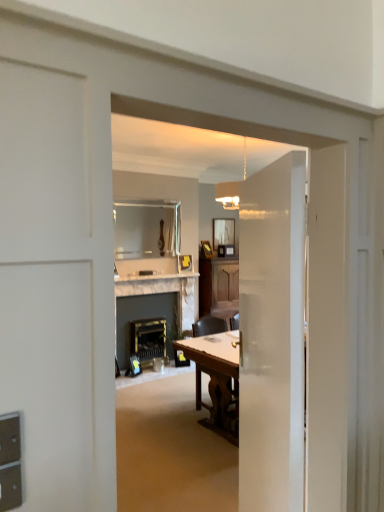
What do you see at coordinates (155, 276) in the screenshot? This screenshot has height=512, width=384. I see `white marble fireplace at center` at bounding box center [155, 276].

Measure the distance between white marble fireplace at center and camera.

5.73 meters.

From the picture: How much space does matte glass mirror at upper center, the 2th mirror when ordered from front to back, occupy vertically?

51.49 centimeters.

What do you see at coordinates (216, 381) in the screenshot? I see `wooden table at center` at bounding box center [216, 381].

Based on the photo, in order to face metallic brass fireplace at center, should I rotate leftwards or rightwards?

Rotate left and turn 5.349 degrees.

The image size is (384, 512). Find the location of `wooden chair at center`. wooden chair at center is located at coordinates (209, 326).

Find the location of a particular element. This screenshot has height=512, width=384. white marble fireplace at center is located at coordinates (139, 317).

The width and height of the screenshot is (384, 512). I want to click on counter top on the left side of wooden table at center, so [155, 276].

Is white marble fireplace at center aimed at wooden table at center?

No, white marble fireplace at center is not aimed at wooden table at center.

Can you confirm if white marble fireplace at center is positioned to the left of wooden table at center?

Yes, white marble fireplace at center is to the left of wooden table at center.

Is the surface of white marble fireplace at center in direct contact with wooden table at center?

white marble fireplace at center and wooden table at center are not in contact.

Does white marble fireplace at center have a greater width compared to wooden table at center?

In fact, white marble fireplace at center might be narrower than wooden table at center.

Is point (138, 306) positioned in front of point (236, 357)?

No, (138, 306) is behind (236, 357).

Starting from the wooden table at center, which mirror is the 1st one behind? Please provide its 2D coordinates.

[(146, 229)]

Choose the correct answer: Is wooden table at center inside clear glass mirror at upper center, positioned as the second mirror in right-to-left order, or outside it?

wooden table at center exists outside the volume of clear glass mirror at upper center, positioned as the second mirror in right-to-left order.

Considering the relative sizes of wooden table at center and clear glass mirror at upper center, which appears as the second mirror when viewed from the back, in the image provided, is wooden table at center smaller than clear glass mirror at upper center, which appears as the second mirror when viewed from the back,?

Incorrect, wooden table at center is not smaller in size than clear glass mirror at upper center, which appears as the second mirror when viewed from the back.

From a real-world perspective, is white glossy door at center over clear glass mirror at upper center, acting as the first mirror starting from the front?

Actually, white glossy door at center is physically below clear glass mirror at upper center, acting as the first mirror starting from the front, in the real world.

Between white glossy door at center and clear glass mirror at upper center, acting as the first mirror starting from the front, which one has smaller size?

clear glass mirror at upper center, acting as the first mirror starting from the front.

From the image's perspective, between white glossy door at center and clear glass mirror at upper center, the first mirror from the left, who is located below?

A: white glossy door at center, from the image's perspective.

From a real-world perspective, which is physically above, wooden chair at center or metallic brass fireplace at center?

wooden chair at center.

Which is more to the right, wooden chair at center or metallic brass fireplace at center?

Positioned to the right is wooden chair at center.

Considering the points (220, 328) and (137, 354), which point is in front, point (220, 328) or point (137, 354)?

The point (220, 328) is more forward.

Can you tell me how much matte glass mirror at upper center, which is the 1th mirror from back to front, and clear glass mirror at upper center, positioned as the second mirror in right-to-left order, differ in facing direction?

They differ by 0.253 degrees in their facing directions.

Relative to clear glass mirror at upper center, which appears as the second mirror when viewed from the back, is matte glass mirror at upper center, acting as the 2th mirror starting from the left, in front or behind?

matte glass mirror at upper center, acting as the 2th mirror starting from the left, is positioned farther from the viewer than clear glass mirror at upper center, which appears as the second mirror when viewed from the back.

Looking at this image, is matte glass mirror at upper center, the 2th mirror when ordered from front to back, taller or shorter than clear glass mirror at upper center, acting as the first mirror starting from the front?

Clearly, matte glass mirror at upper center, the 2th mirror when ordered from front to back, is shorter compared to clear glass mirror at upper center, acting as the first mirror starting from the front.

Considering the relative sizes of matte glass mirror at upper center, which is counted as the 1th mirror, starting from the right, and clear glass mirror at upper center, which appears as the second mirror when viewed from the back, in the image provided, is matte glass mirror at upper center, which is counted as the 1th mirror, starting from the right, thinner than clear glass mirror at upper center, which appears as the second mirror when viewed from the back,?

Incorrect, the width of matte glass mirror at upper center, which is counted as the 1th mirror, starting from the right, is not less than that of clear glass mirror at upper center, which appears as the second mirror when viewed from the back.

Is point (231, 228) in front of point (121, 297)?

That is False.

Is matte glass mirror at upper center, the 2th mirror when ordered from front to back, facing towards white marble fireplace at center?

No.

From the picture: Can you confirm if matte glass mirror at upper center, the 2th mirror when ordered from front to back, is taller than white marble fireplace at center?

In fact, matte glass mirror at upper center, the 2th mirror when ordered from front to back, may be shorter than white marble fireplace at center.

Is matte glass mirror at upper center, acting as the 2th mirror starting from the left, not within white marble fireplace at center?

That's correct, matte glass mirror at upper center, acting as the 2th mirror starting from the left, is outside of white marble fireplace at center.

At what (x,y) coordinates should I click in order to perform the action: click on counter top above the wooden table at center (from the image's perspective). Please return your answer as a coordinate pair (x, y). Looking at the image, I should click on (155, 276).

Locate an element on the screen. fireplace above the wooden table at center (from a real-world perspective) is located at coordinates (139, 317).

Based on their spatial positions, is white glossy door at center or wooden chair at center closer to white marble fireplace at center?

wooden chair at center is closer to white marble fireplace at center.

When comparing their distances from clear glass mirror at upper center, positioned as the second mirror in right-to-left order, does white glossy door at center or matte glass mirror at upper center, acting as the 2th mirror starting from the left, seem closer?

matte glass mirror at upper center, acting as the 2th mirror starting from the left, is positioned closer to the anchor clear glass mirror at upper center, positioned as the second mirror in right-to-left order.

Considering their positions, is wooden table at center positioned further to matte glass mirror at upper center, which is the 1th mirror from back to front, than metallic brass fireplace at center?

wooden table at center is positioned further to the anchor matte glass mirror at upper center, which is the 1th mirror from back to front.

Which object lies further to the anchor point metallic brass fireplace at center, white marble fireplace at center or clear glass mirror at upper center, the first mirror from the left?

The object further to metallic brass fireplace at center is clear glass mirror at upper center, the first mirror from the left.

Looking at the image, which one is located further to clear glass mirror at upper center, the first mirror from the left, white marble fireplace at center or wooden table at center?

Based on the image, wooden table at center appears to be further to clear glass mirror at upper center, the first mirror from the left.

From the image, which object appears to be farther from white marble fireplace at center, white marble fireplace at center or matte glass mirror at upper center, which is the 1th mirror from back to front?

Among the two, matte glass mirror at upper center, which is the 1th mirror from back to front, is located further to white marble fireplace at center.

Looking at the image, which one is located closer to wooden chair at center, matte glass mirror at upper center, which is counted as the 1th mirror, starting from the right, or clear glass mirror at upper center, acting as the first mirror starting from the front?

matte glass mirror at upper center, which is counted as the 1th mirror, starting from the right.

Considering their positions, is clear glass mirror at upper center, acting as the first mirror starting from the front, positioned further to white glossy door at center than wooden table at center?

Based on the image, clear glass mirror at upper center, acting as the first mirror starting from the front, appears to be further to white glossy door at center.

Identify the location of counter top between clear glass mirror at upper center, which appears as the second mirror when viewed from the back, and white marble fireplace at center in the up-down direction. The width and height of the screenshot is (384, 512). (155, 276).

I want to click on counter top positioned between wooden chair at center and matte glass mirror at upper center, acting as the 2th mirror starting from the left, from near to far, so click(x=155, y=276).

Identify the location of chair between white glossy door at center and matte glass mirror at upper center, the 2th mirror when ordered from front to back, along the z-axis. (209, 326).

Find the location of `fireplace positioned between wooden chair at center and matte glass mirror at upper center, acting as the 2th mirror starting from the left, from near to far`. fireplace positioned between wooden chair at center and matte glass mirror at upper center, acting as the 2th mirror starting from the left, from near to far is located at coordinates pyautogui.click(x=139, y=317).